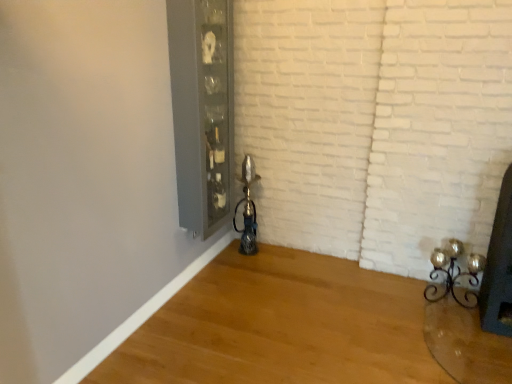
Question: Does point (207, 49) appear closer or farther from the camera than point (425, 294)?

Choices:
 (A) closer
 (B) farther

Answer: (A)

Question: Is clear glass cabinet at upper center bigger or smaller than gold metallic candle holder at lower right?

Choices:
 (A) small
 (B) big

Answer: (B)

Question: From a real-world perspective, is clear glass cabinet at upper center above or below gold metallic candle holder at lower right?

Choices:
 (A) below
 (B) above

Answer: (B)

Question: From their relative heights in the image, would you say gold metallic candle holder at lower right is taller or shorter than clear glass cabinet at upper center?

Choices:
 (A) tall
 (B) short

Answer: (B)

Question: From the image's perspective, is gold metallic candle holder at lower right located above or below clear glass cabinet at upper center?

Choices:
 (A) below
 (B) above

Answer: (A)

Question: Would you say gold metallic candle holder at lower right is to the left or to the right of clear glass cabinet at upper center in the picture?

Choices:
 (A) right
 (B) left

Answer: (A)

Question: Looking at their shapes, would you say gold metallic candle holder at lower right is wider or thinner than clear glass cabinet at upper center?

Choices:
 (A) thin
 (B) wide

Answer: (B)